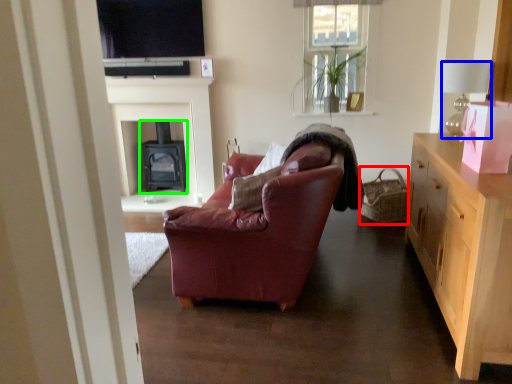
Question: Estimate the real-world distances between objects in this image. Which object is farther from picnic basket (highlighted by a red box), lamp (highlighted by a blue box) or fireplace (highlighted by a green box)?

Choices:
 (A) lamp
 (B) fireplace

Answer: (B)